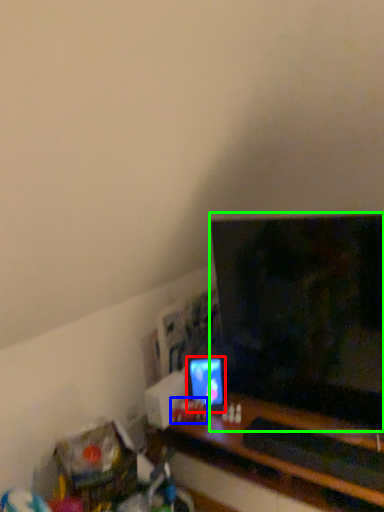
Question: Based on their relative distances, which object is farther from computer monitor (highlighted by a red box)? Choose from toy (highlighted by a blue box) and television (highlighted by a green box).

Choices:
 (A) toy
 (B) television

Answer: (B)